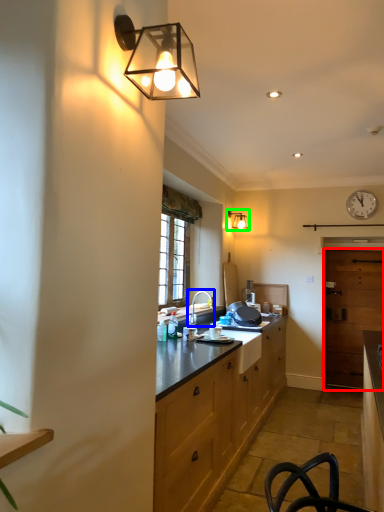
Question: Estimate the real-world distances between objects in this image. Which object is farther from glass door (highlighted by a red box), tap (highlighted by a blue box) or lamp (highlighted by a green box)?

Choices:
 (A) tap
 (B) lamp

Answer: (A)